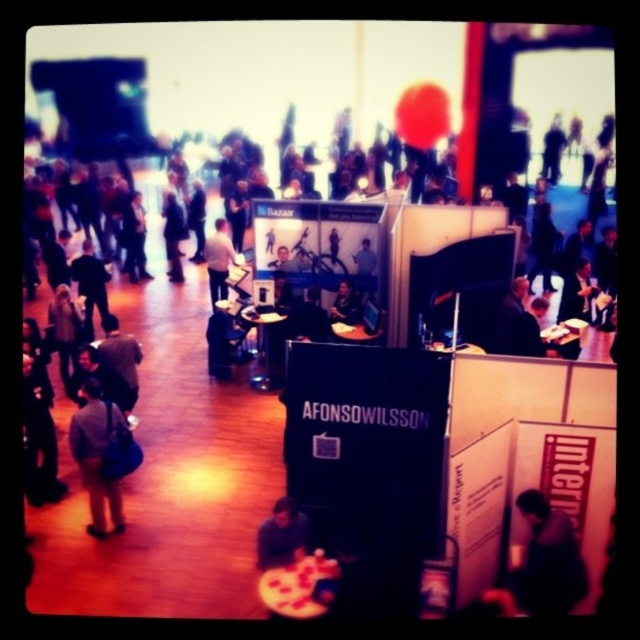
How distant is dark gray fabric shirt at lower right from dark brown hair at lower center?

dark gray fabric shirt at lower right and dark brown hair at lower center are 8.03 feet apart from each other.

Between dark gray fabric shirt at lower right and dark brown hair at lower center, which one has more height?

Standing taller between the two is dark gray fabric shirt at lower right.

Does point (572, 579) lie in front of point (305, 518)?

Yes.

The image size is (640, 640). Find the location of `dark gray fabric shirt at lower right`. dark gray fabric shirt at lower right is located at coordinates (547, 561).

Between dark gray fabric shirt at lower right and white fabric shirt at center, which one appears on the left side from the viewer's perspective?

white fabric shirt at center

Does dark gray fabric shirt at lower right appear over white fabric shirt at center?

No, dark gray fabric shirt at lower right is not above white fabric shirt at center.

Is point (536, 611) positioned after point (236, 264)?

No.

The width and height of the screenshot is (640, 640). I want to click on dark gray fabric shirt at lower right, so click(547, 561).

Is gray fabric jacket at left to the left of dark brown hair at lower center from the viewer's perspective?

Correct, you'll find gray fabric jacket at left to the left of dark brown hair at lower center.

Can you confirm if gray fabric jacket at left is positioned above dark brown hair at lower center?

Indeed, gray fabric jacket at left is positioned over dark brown hair at lower center.

Who is more forward, (116,508) or (304,532)?

Point (304,532) is in front.

Find the location of a particular element. gray fabric jacket at left is located at coordinates (97, 456).